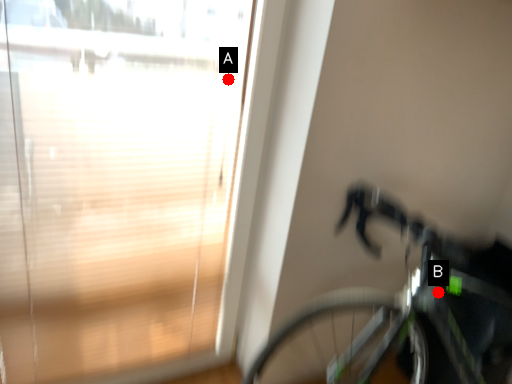
Question: Two points are circled on the image, labeled by A and B beside each circle. Which point is closer to the camera?

Choices:
 (A) A is closer
 (B) B is closer

Answer: (B)